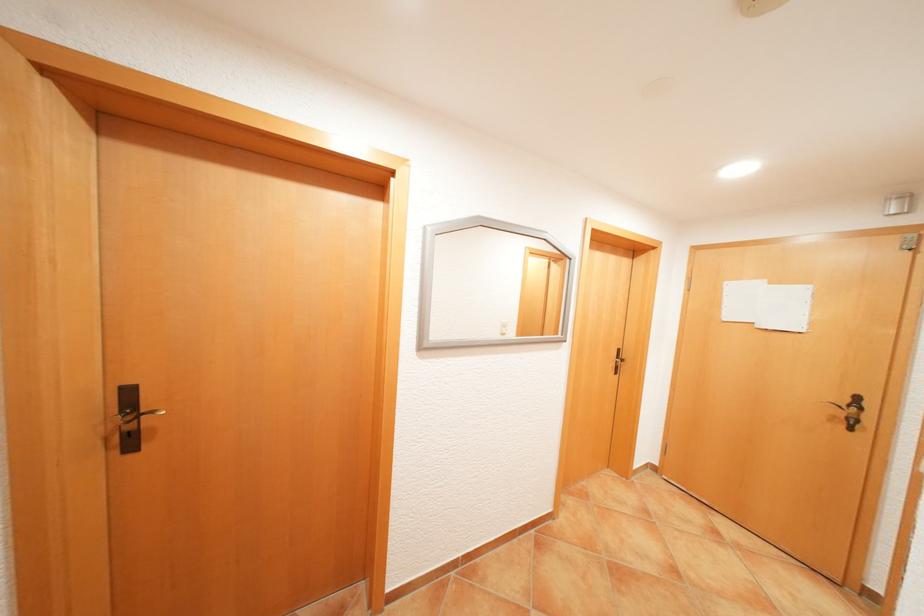
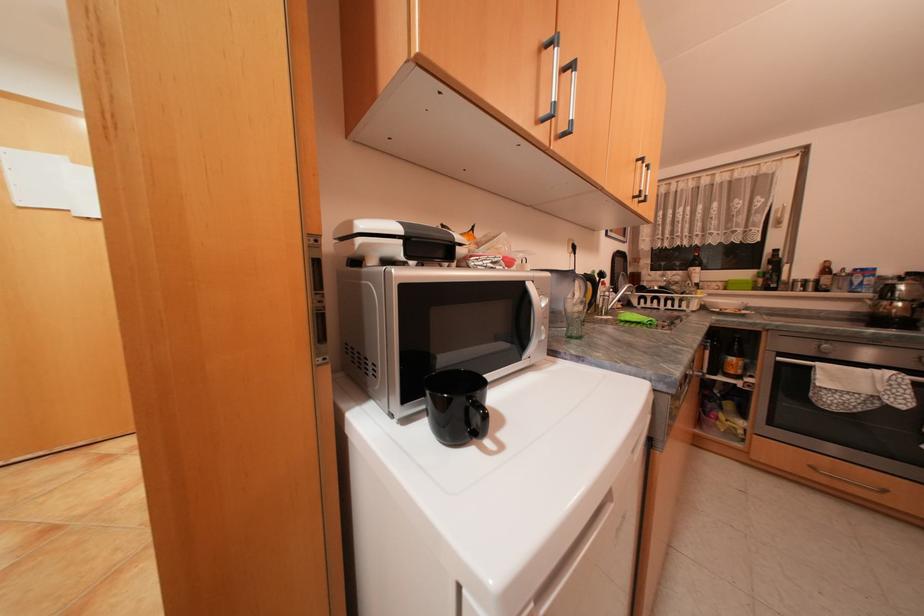
Question: Based on the continuous images, in which direction is the camera rotating? Reply with the corresponding letter.

Choices:
 (A) Left
 (B) Right
 (C) Up
 (D) Down

Answer: (B)